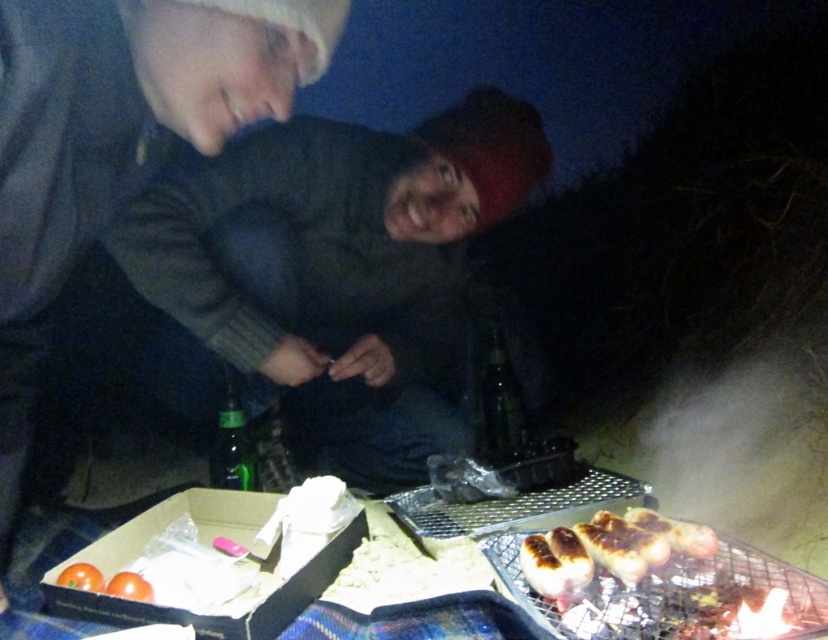
You are organizing a small event and need to place a decorative item on a narrow shelf. The shelf can only hold items that are narrower than the dark gray sweater at upper left. Do you think the orange matte tomato at lower left will fit on the shelf?

The dark gray sweater at upper left might be wider than the orange matte tomato at lower left, so there is a possibility that the orange matte tomato at lower left could fit on the shelf if the sweater is indeed wider. However, since the exact width difference isn not specified, it is uncertain without more information.

You are planning to serve a barbecue snack and have both the charred white bread at lower right and the orange matte tomato at lower left available. Which item would you choose if you want something bigger for your snack?

The charred white bread at lower right is larger in size than the orange matte tomato at lower left, so you should choose the charred white bread at lower right for a bigger snack.

You are standing in the nighttime barbecue scene. You need to locate the dark gray sweater at upper left. Where exactly is it positioned in the scene?

The dark gray sweater at upper left is located at point (x=118, y=138).